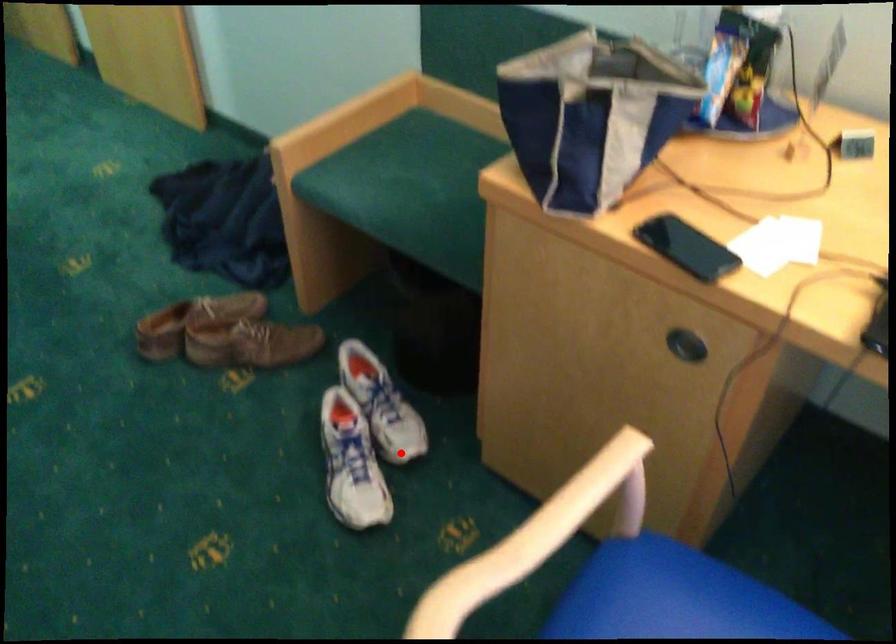
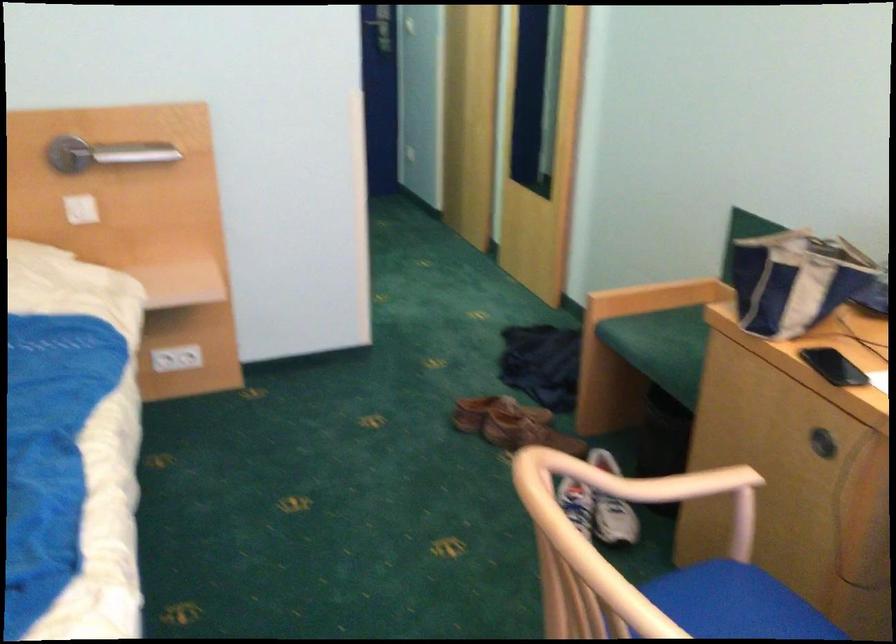
Where in the second image is the point corresponding to the highlighted location from the first image?

(609, 542)